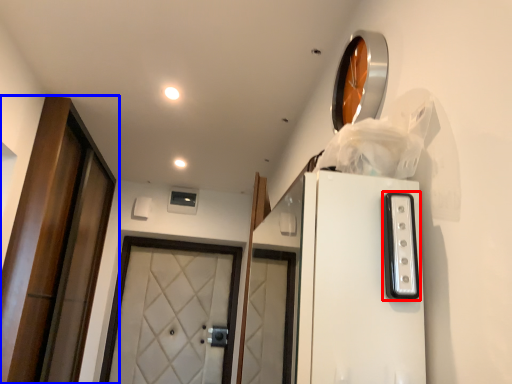
Question: Among these objects, which one is farthest to the camera, appliance (highlighted by a red box) or door (highlighted by a blue box)?

Choices:
 (A) appliance
 (B) door

Answer: (B)